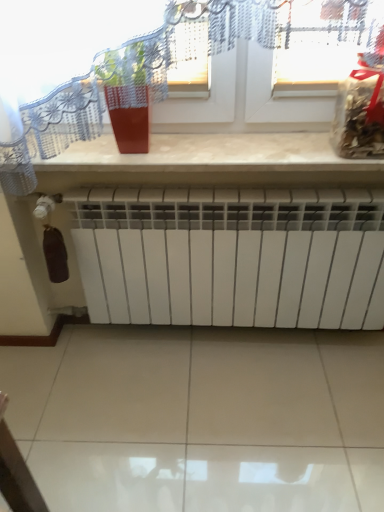
Where is `free space in front of matte red pot at upper center`? The image size is (384, 512). free space in front of matte red pot at upper center is located at coordinates (135, 159).